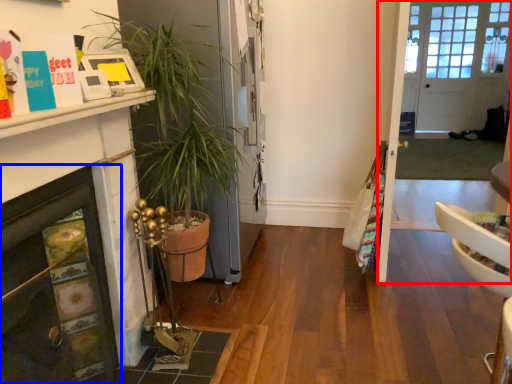
Question: Which point is closer to the camera, glass door (highlighted by a red box) or fireplace (highlighted by a blue box)?

Choices:
 (A) glass door
 (B) fireplace

Answer: (B)